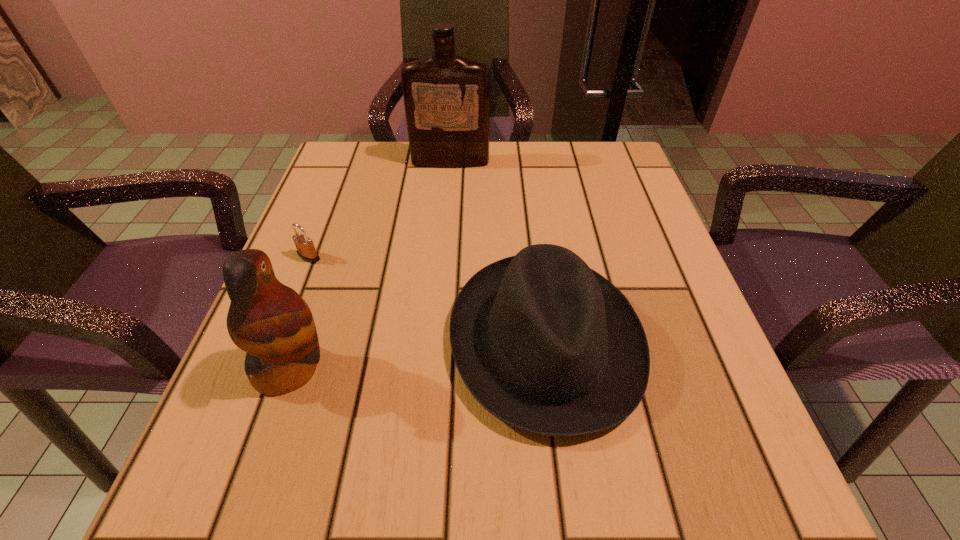
Identify the location of vacant space at the far right corner. (611, 142).

You are a GUI agent. You are given a task and a screenshot of the screen. Output one action in this format:
    pyautogui.click(x=<x>, y=<y>)
    Task: Click on the free space between the second farthest object and the tallest object
    The image size is (960, 540).
    Given the screenshot: What is the action you would take?
    pyautogui.click(x=379, y=210)

You are a GUI agent. You are given a task and a screenshot of the screen. Output one action in this format:
    pyautogui.click(x=<x>, y=<y>)
    Task: Click on the unoccupied position between the farthest object and the second shortest object
    Image resolution: width=960 pixels, height=540 pixels.
    Given the screenshot: What is the action you would take?
    pyautogui.click(x=498, y=252)

The width and height of the screenshot is (960, 540). In order to click on free point between the second tallest object and the farthest object in this screenshot , I will do `click(371, 265)`.

You are a GUI agent. You are given a task and a screenshot of the screen. Output one action in this format:
    pyautogui.click(x=<x>, y=<y>)
    Task: Click on the blank region between the liquor and the second tallest object
    This screenshot has height=540, width=960.
    Given the screenshot: What is the action you would take?
    pyautogui.click(x=371, y=265)

Locate an element on the screen. Image resolution: width=960 pixels, height=540 pixels. empty space between the padlock and the fedora is located at coordinates (427, 299).

Image resolution: width=960 pixels, height=540 pixels. Identify the location of free space between the third shortest object and the tallest object. (371, 265).

Where is `free space between the second tallest object and the liquor`? free space between the second tallest object and the liquor is located at coordinates (371, 265).

You are a GUI agent. You are given a task and a screenshot of the screen. Output one action in this format:
    pyautogui.click(x=<x>, y=<y>)
    Task: Click on the free space between the shortest object and the fedora
    
    Given the screenshot: What is the action you would take?
    pyautogui.click(x=427, y=299)

Where is `empty space between the second tallest object and the farthest object`? empty space between the second tallest object and the farthest object is located at coordinates (371, 265).